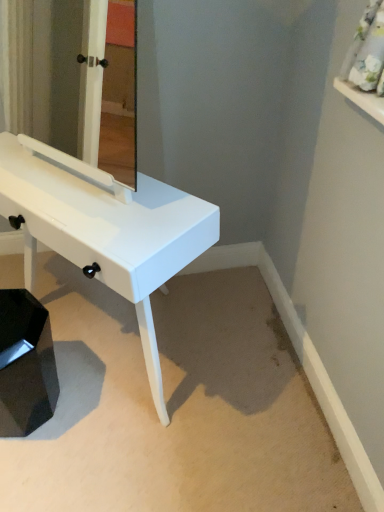
Question: Considering the relative positions of white glossy table at center and white glossy mirror at center in the image provided, is white glossy table at center to the right of white glossy mirror at center from the viewer's perspective?

Choices:
 (A) yes
 (B) no

Answer: (B)

Question: Is the depth of white glossy table at center less than that of white glossy mirror at center?

Choices:
 (A) yes
 (B) no

Answer: (B)

Question: Is white glossy table at center surrounding white glossy mirror at center?

Choices:
 (A) yes
 (B) no

Answer: (B)

Question: Does white glossy table at center appear on the left side of white glossy mirror at center?

Choices:
 (A) yes
 (B) no

Answer: (A)

Question: Is white glossy table at center further to the viewer compared to white glossy mirror at center?

Choices:
 (A) yes
 (B) no

Answer: (A)

Question: From the image's perspective, is white glossy table at center below white glossy mirror at center?

Choices:
 (A) no
 (B) yes

Answer: (B)

Question: Considering the relative sizes of white glossy mirror at center and white glossy table at center in the image provided, is white glossy mirror at center bigger than white glossy table at center?

Choices:
 (A) no
 (B) yes

Answer: (A)

Question: Considering the relative sizes of white glossy mirror at center and white glossy table at center in the image provided, is white glossy mirror at center thinner than white glossy table at center?

Choices:
 (A) yes
 (B) no

Answer: (A)

Question: Considering the relative positions of white glossy mirror at center and white glossy table at center in the image provided, is white glossy mirror at center to the left of white glossy table at center from the viewer's perspective?

Choices:
 (A) no
 (B) yes

Answer: (A)

Question: Can you confirm if white glossy mirror at center is smaller than white glossy table at center?

Choices:
 (A) yes
 (B) no

Answer: (A)

Question: Does white glossy mirror at center have a lesser height compared to white glossy table at center?

Choices:
 (A) yes
 (B) no

Answer: (A)

Question: From the image's perspective, would you say white glossy mirror at center is positioned over white glossy table at center?

Choices:
 (A) yes
 (B) no

Answer: (A)

Question: Is white glossy mirror at center thinner than black glossy step stool at lower left?

Choices:
 (A) no
 (B) yes

Answer: (B)